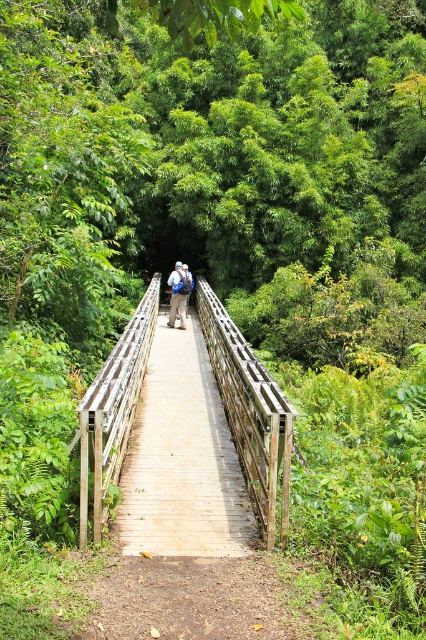
Question: Which of the following is the farthest from the observer?

Choices:
 (A) (172, 301)
 (B) (104, 388)

Answer: (A)

Question: Among these objects, which one is farthest from the camera?

Choices:
 (A) wooden bridge at center
 (B) blue fabric backpack at center

Answer: (B)

Question: Which object appears farthest from the camera in this image?

Choices:
 (A) wooden bridge at center
 (B) blue fabric backpack at center

Answer: (B)

Question: In this image, where is wooden bridge at center located relative to blue fabric backpack at center?

Choices:
 (A) above
 (B) below

Answer: (B)

Question: Is wooden bridge at center above blue fabric backpack at center?

Choices:
 (A) yes
 (B) no

Answer: (B)

Question: Can you confirm if wooden bridge at center is positioned to the left of blue fabric backpack at center?

Choices:
 (A) no
 (B) yes

Answer: (B)